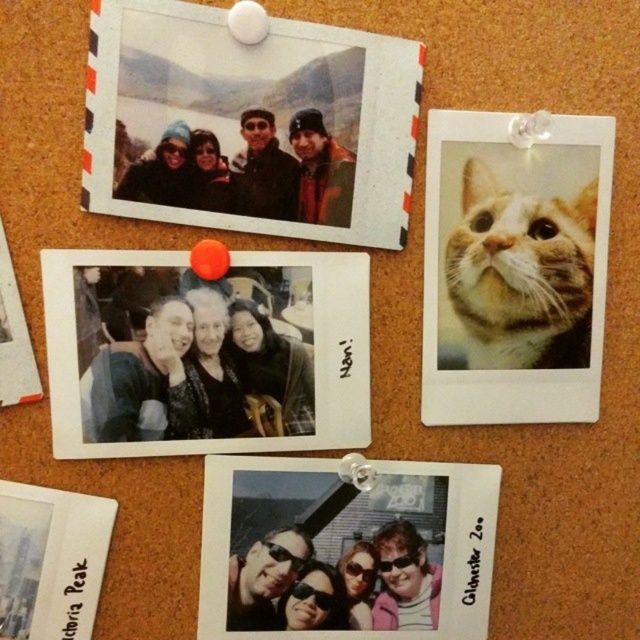
Question: Can you confirm if matte black photo at upper left is positioned to the right of matte black photo at center?

Choices:
 (A) yes
 (B) no

Answer: (A)

Question: Which of these objects is positioned closest to the matte plastic photo at bottom center?

Choices:
 (A) matte black photo at upper left
 (B) orange fur cat at upper right
 (C) white paper postcard at lower left
 (D) matte black photo at center

Answer: (D)

Question: Among these objects, which one is farthest from the camera?

Choices:
 (A) matte plastic photo at bottom center
 (B) white paper postcard at lower left
 (C) matte black photo at center

Answer: (A)

Question: Is matte black photo at center to the left of orange fur cat at upper right from the viewer's perspective?

Choices:
 (A) no
 (B) yes

Answer: (B)

Question: Based on their relative distances, which object is farther from the matte plastic photo at bottom center?

Choices:
 (A) matte black photo at upper left
 (B) white paper postcard at lower left
 (C) orange fur cat at upper right

Answer: (A)

Question: Does matte black photo at center lie behind white paper postcard at lower left?

Choices:
 (A) no
 (B) yes

Answer: (A)